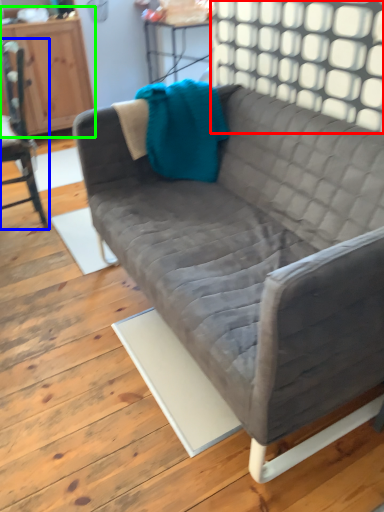
Question: Which is nearer to the window (highlighted by a red box)? chair (highlighted by a blue box) or dresser (highlighted by a green box).

Choices:
 (A) chair
 (B) dresser

Answer: (A)